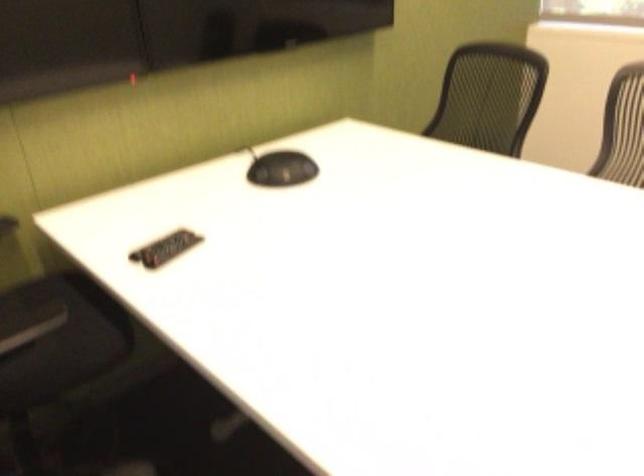
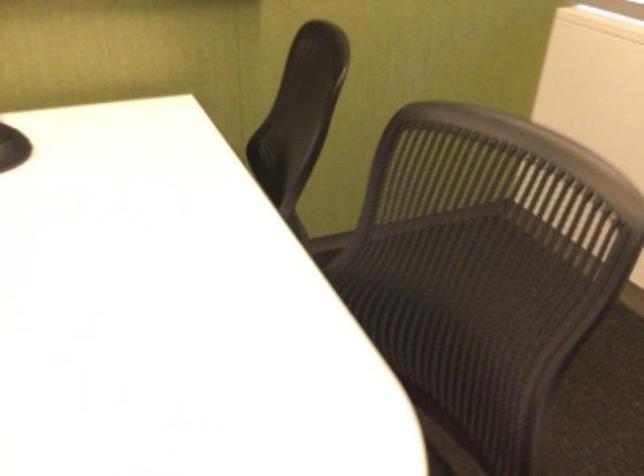
Which direction would the cameraman need to move to produce the second image?

The cameraman walked toward right, forward.